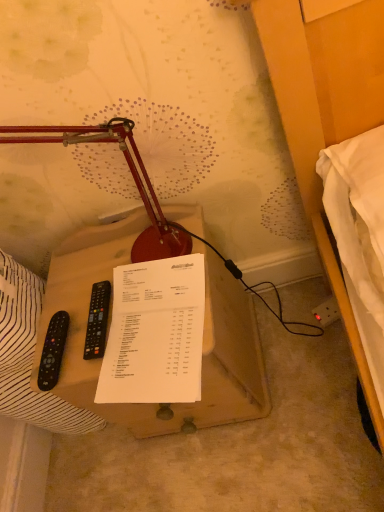
Question: Considering the positions of point (62, 425) and point (110, 140), is point (62, 425) closer or farther from the camera than point (110, 140)?

Choices:
 (A) farther
 (B) closer

Answer: (A)

Question: From the image's perspective, is white paper at left located above or below matte red lamp at center?

Choices:
 (A) above
 (B) below

Answer: (B)

Question: Estimate the real-world distances between objects in this image. Which object is closer to the white paper at left?

Choices:
 (A) matte red lamp at center
 (B) white paper at center
 (C) black plastic remote at left, the second remote control in the right-to-left sequence
 (D) wooden table at center
 (E) black plastic remote control at left, acting as the 2th remote control starting from the left

Answer: (C)

Question: Which object is positioned farthest from the black plastic remote at left, which is the 1th remote control in left-to-right order?

Choices:
 (A) white paper at left
 (B) wooden table at center
 (C) matte red lamp at center
 (D) white paper at center
 (E) black plastic remote control at left, which is the 1th remote control in right-to-left order

Answer: (C)